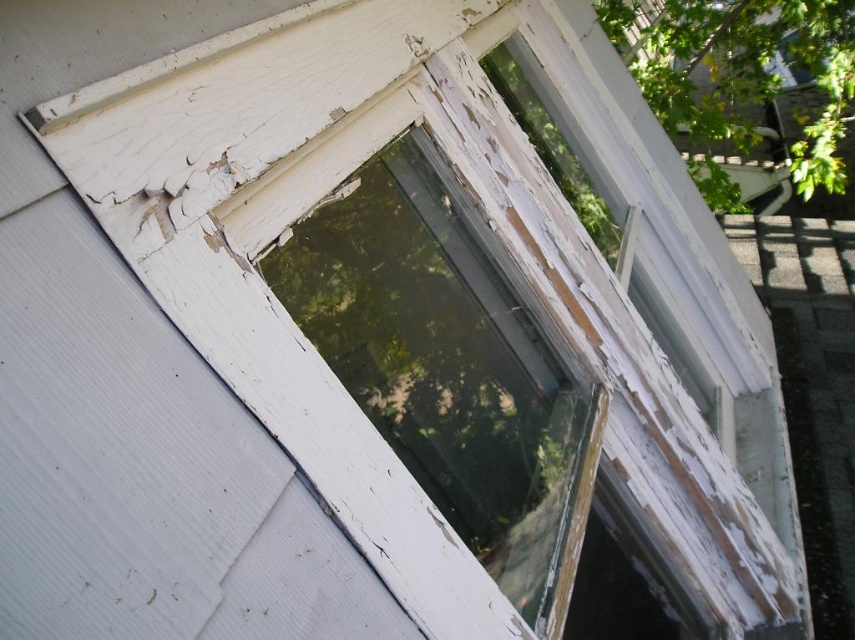
Question: Can you confirm if transparent glass window at center is thinner than green leafy tree at upper right?

Choices:
 (A) yes
 (B) no

Answer: (A)

Question: Does transparent glass window at center have a lesser width compared to green leafy tree at upper right?

Choices:
 (A) yes
 (B) no

Answer: (A)

Question: Which point is closer to the camera taking this photo?

Choices:
 (A) (817, 161)
 (B) (581, 396)

Answer: (B)

Question: From the image, what is the correct spatial relationship of transparent glass window at center in relation to green leafy tree at upper right?

Choices:
 (A) left
 (B) right

Answer: (A)

Question: Which object is closer to the camera taking this photo?

Choices:
 (A) green leafy tree at upper right
 (B) transparent glass window at center

Answer: (B)